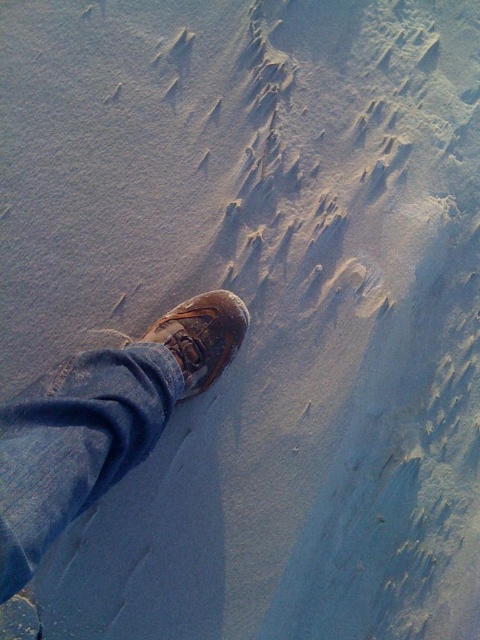
You are trying to choose between two brown leather shoes to wear in the snow. The brown leather shoe at center and the brown leather shoe at lower left are both options. Which one would you pick if you want the bigger size?

The brown leather shoe at center is larger in size than the brown leather shoe at lower left, so you should pick the brown leather shoe at center for the bigger size.

You are a photographer trying to capture the texture of the snow in the image. You notice two brown leather shoes in the scene. Which one is positioned closer to the camera, the brown leather shoe at center or the brown leather shoe at lower left?

The brown leather shoe at center is closer to the viewer than the brown leather shoe at lower left, so it is positioned closer to the camera.

You are trying to place a small snow anchor at point (100, 422). Is there enough space to do so?

The point (100, 422) has a brown leather shoe at center, so there is no space to place the snow anchor there.